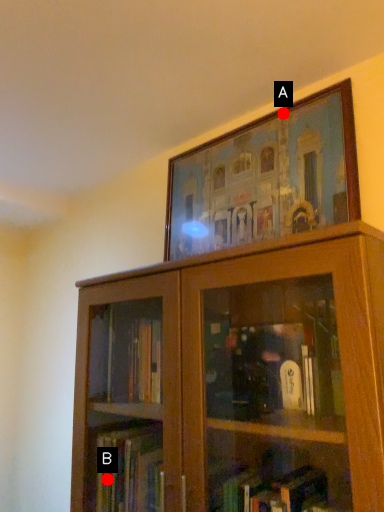
Question: Two points are circled on the image, labeled by A and B beside each circle. Which point is closer to the camera taking this photo?

Choices:
 (A) A is closer
 (B) B is closer

Answer: (B)